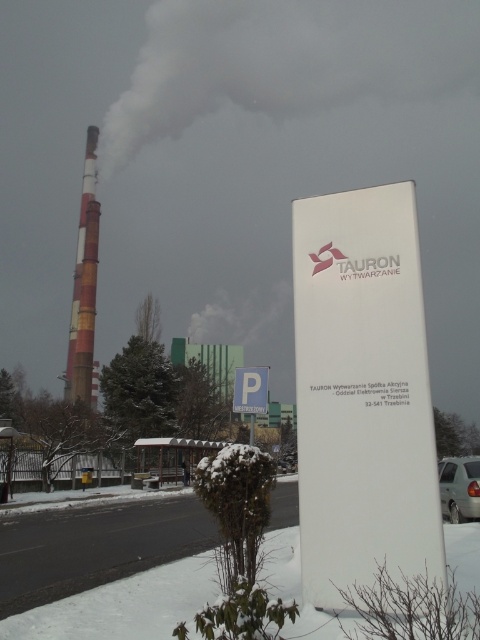
Question: Which object is the closest to the white plastic sign at center?

Choices:
 (A) white matte van at lower right
 (B) blue plastic parking sign at center
 (C) red and white striped chimney at left

Answer: (A)

Question: Does white smoke at upper center have a lesser width compared to blue plastic parking sign at center?

Choices:
 (A) yes
 (B) no

Answer: (B)

Question: Is white smoke at upper center to the right of blue plastic parking sign at center from the viewer's perspective?

Choices:
 (A) no
 (B) yes

Answer: (B)

Question: Is white plastic sign at center below red and white striped chimney at left?

Choices:
 (A) yes
 (B) no

Answer: (A)

Question: Considering the real-world distances, which object is closest to the white plastic sign at center?

Choices:
 (A) white smoke at upper center
 (B) white matte van at lower right

Answer: (B)

Question: Considering the real-world distances, which object is closest to the white plastic sign at center?

Choices:
 (A) white smoke at upper center
 (B) white matte van at lower right
 (C) red and white striped chimney at left
 (D) blue plastic parking sign at center

Answer: (B)